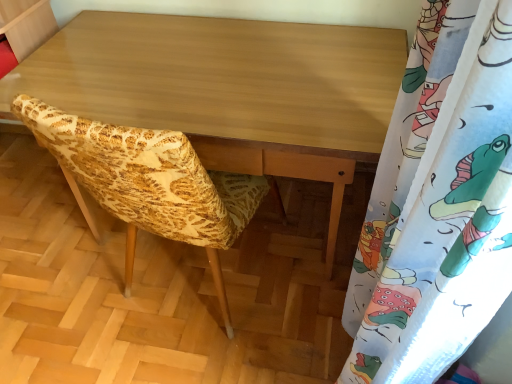
You are a GUI agent. You are given a task and a screenshot of the screen. Output one action in this format:
    pyautogui.click(x=<x>, y=<y>)
    Task: Click on the free point behind white fabric with colorful cartoon print at right
    This screenshot has width=512, height=384.
    Given the screenshot: What is the action you would take?
    pyautogui.click(x=298, y=296)